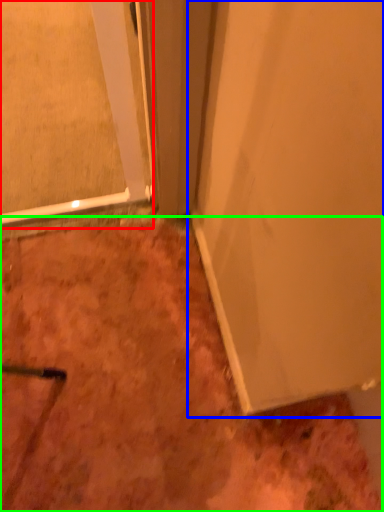
Question: Which is nearer to the glass door (highlighted by a red box)? door (highlighted by a blue box) or dirt (highlighted by a green box).

Choices:
 (A) door
 (B) dirt

Answer: (A)